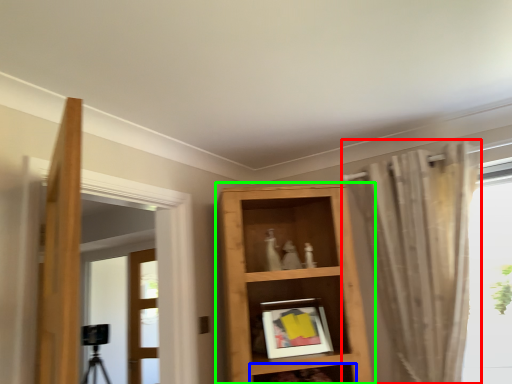
Question: Which is farther away from curtain (highlighted by a red box)? shelf (highlighted by a blue box) or shelf (highlighted by a green box)?

Choices:
 (A) shelf
 (B) shelf

Answer: (A)